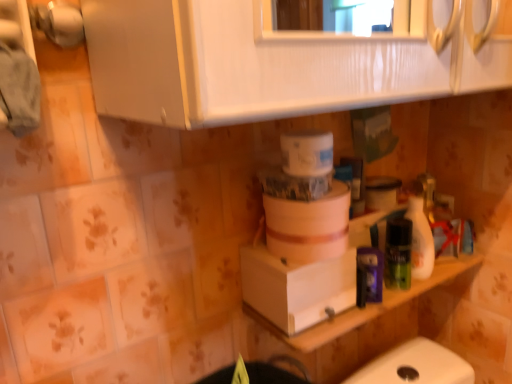
Question: From a real-world perspective, does white cardboard box at center stand above white matte container at center?

Choices:
 (A) no
 (B) yes

Answer: (A)

Question: From a real-world perspective, is white cardboard box at center below white matte container at center?

Choices:
 (A) no
 (B) yes

Answer: (B)

Question: From the image's perspective, would you say white cardboard box at center is shown under white matte container at center?

Choices:
 (A) no
 (B) yes

Answer: (B)

Question: Does white cardboard box at center lie behind white matte container at center?

Choices:
 (A) no
 (B) yes

Answer: (B)

Question: Considering the relative sizes of white cardboard box at center and white matte container at center in the image provided, is white cardboard box at center shorter than white matte container at center?

Choices:
 (A) yes
 (B) no

Answer: (B)

Question: Would you consider white cardboard box at center to be distant from white matte container at center?

Choices:
 (A) yes
 (B) no

Answer: (B)

Question: Is white glossy bottle at right positioned behind white matte container at center?

Choices:
 (A) yes
 (B) no

Answer: (A)

Question: Can you confirm if white glossy bottle at right is wider than white matte container at center?

Choices:
 (A) yes
 (B) no

Answer: (B)

Question: Does white glossy bottle at right appear on the right side of white matte container at center?

Choices:
 (A) yes
 (B) no

Answer: (A)

Question: Is white glossy bottle at right surrounding white matte container at center?

Choices:
 (A) yes
 (B) no

Answer: (B)

Question: Considering the relative positions of white glossy bottle at right and white matte container at center in the image provided, is white glossy bottle at right in front of white matte container at center?

Choices:
 (A) yes
 (B) no

Answer: (B)

Question: Is white glossy bottle at right far away from white matte container at center?

Choices:
 (A) yes
 (B) no

Answer: (B)

Question: Does white matte counter top at lower right have a smaller size compared to white glossy bottle at right?

Choices:
 (A) yes
 (B) no

Answer: (B)